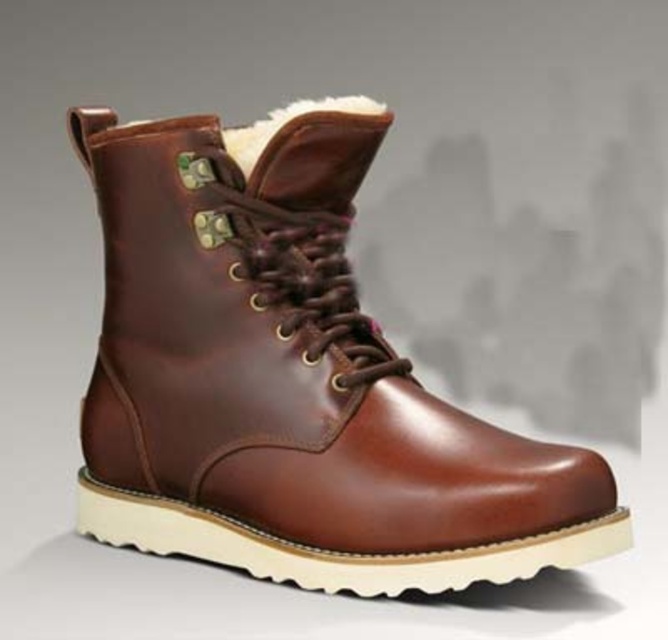
Which is more to the right, brown leather boot at center or white fluffy fur at upper center?

Positioned to the right is white fluffy fur at upper center.

In order to click on brown leather boot at center in this screenshot , I will do `click(291, 385)`.

Locate an element on the screen. brown leather boot at center is located at coordinates (291, 385).